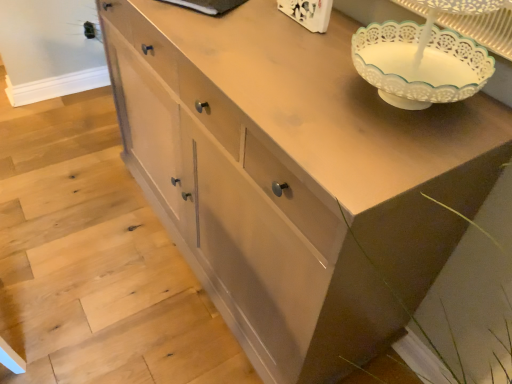
Image resolution: width=512 pixels, height=384 pixels. I want to click on green leafy plant at lower right, so click(468, 301).

What do you see at coordinates (468, 301) in the screenshot? Image resolution: width=512 pixels, height=384 pixels. I see `green leafy plant at lower right` at bounding box center [468, 301].

Identify the location of green leafy plant at lower right. The width and height of the screenshot is (512, 384). (468, 301).